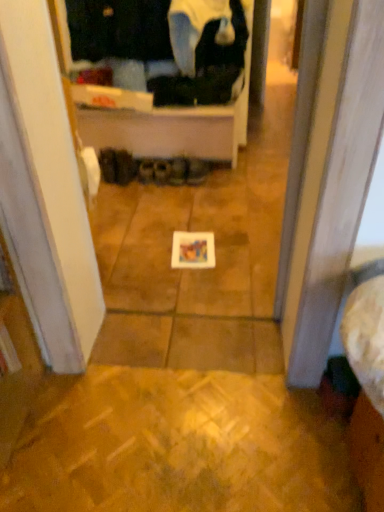
Question: Is black fabric shoes at center, marked as the 1th footwear in a left-to-right arrangement, positioned behind leather brown shoes at center, the sixth footwear from the left?

Choices:
 (A) no
 (B) yes

Answer: (B)

Question: Is black fabric shoes at center, marked as the 1th footwear in a left-to-right arrangement, positioned far away from leather brown shoes at center, which is counted as the first footwear, starting from the right?

Choices:
 (A) yes
 (B) no

Answer: (B)

Question: Is black fabric shoes at center, marked as the 1th footwear in a left-to-right arrangement, taller than leather brown shoes at center, which is counted as the first footwear, starting from the right?

Choices:
 (A) yes
 (B) no

Answer: (A)

Question: Does black fabric shoes at center, which is counted as the sixth footwear, starting from the right, have a lesser width compared to leather brown shoes at center, which is counted as the first footwear, starting from the right?

Choices:
 (A) yes
 (B) no

Answer: (A)

Question: Is black fabric shoes at center, marked as the 1th footwear in a left-to-right arrangement, shorter than leather brown shoes at center, the sixth footwear from the left?

Choices:
 (A) yes
 (B) no

Answer: (B)

Question: In the image, is leather brown shoes at center, the sixth footwear from the left, on the left side or the right side of black fabric shoes at center, the 3th footwear when ordered from left to right?

Choices:
 (A) right
 (B) left

Answer: (A)

Question: Is leather brown shoes at center, the sixth footwear from the left, inside the boundaries of black fabric shoes at center, arranged as the 4th footwear when viewed from the right, or outside?

Choices:
 (A) inside
 (B) outside

Answer: (B)

Question: Is leather brown shoes at center, which is counted as the first footwear, starting from the right, taller or shorter than black fabric shoes at center, the 3th footwear when ordered from left to right?

Choices:
 (A) short
 (B) tall

Answer: (B)

Question: Is point (195, 177) positioned closer to the camera than point (145, 172)?

Choices:
 (A) closer
 (B) farther

Answer: (A)

Question: Considering their positions, is black fabric shoes at center, arranged as the 4th footwear when viewed from the right, located in front of or behind black fabric at upper center?

Choices:
 (A) front
 (B) behind

Answer: (B)

Question: Looking at the image, does black fabric shoes at center, arranged as the 4th footwear when viewed from the right, seem bigger or smaller compared to black fabric at upper center?

Choices:
 (A) small
 (B) big

Answer: (A)

Question: From their relative heights in the image, would you say black fabric shoes at center, arranged as the 4th footwear when viewed from the right, is taller or shorter than black fabric at upper center?

Choices:
 (A) short
 (B) tall

Answer: (A)

Question: From the image's perspective, is black fabric shoes at center, arranged as the 4th footwear when viewed from the right, positioned above or below black fabric at upper center?

Choices:
 (A) above
 (B) below

Answer: (B)

Question: From a real-world perspective, is brown suede shoes at center, which ranks as the fourth footwear in left-to-right order, physically located above or below leather brown shoes at center, the sixth footwear from the left?

Choices:
 (A) below
 (B) above

Answer: (A)

Question: Is point (153, 178) positioned closer to the camera than point (205, 172)?

Choices:
 (A) closer
 (B) farther

Answer: (A)